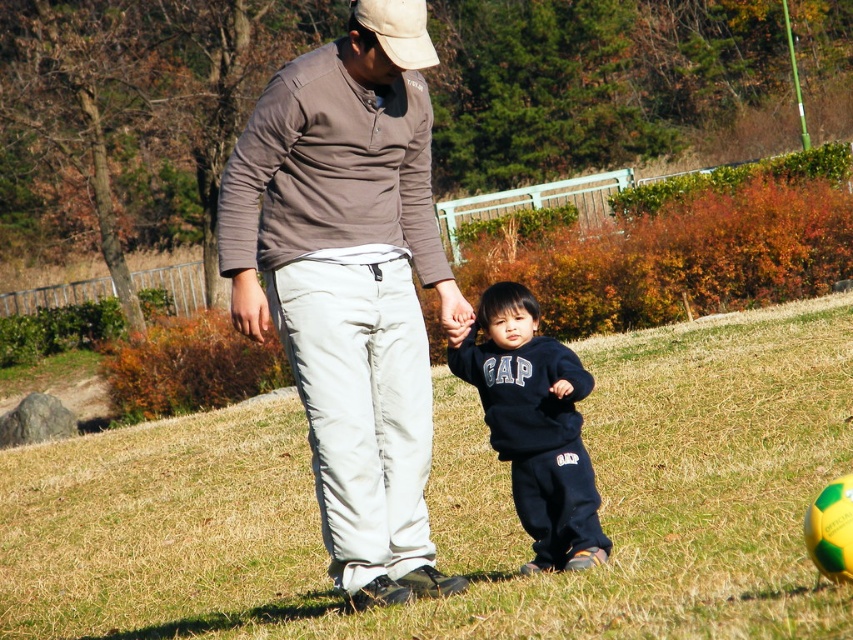
Is black fleece sweatshirt at center bigger than white fabric baseball cap at upper center?

Yes.

Describe the element at coordinates (535, 426) in the screenshot. I see `black fleece sweatshirt at center` at that location.

At what (x,y) coordinates should I click in order to perform the action: click on black fleece sweatshirt at center. Please return your answer as a coordinate pair (x, y). Looking at the image, I should click on (535, 426).

Who is higher up, matte brown shirt at center or black fleece sweatshirt at center?

Positioned higher is matte brown shirt at center.

Can you confirm if matte brown shirt at center is thinner than black fleece sweatshirt at center?

Correct, matte brown shirt at center's width is less than black fleece sweatshirt at center's.

Does point (288, 264) come farther from viewer compared to point (527, 337)?

No, (288, 264) is in front of (527, 337).

Where is `matte brown shirt at center`? This screenshot has height=640, width=853. matte brown shirt at center is located at coordinates (347, 294).

Which is above, green grass at center or white fabric baseball cap at upper center?

white fabric baseball cap at upper center is above.

Looking at this image, who is taller, green grass at center or white fabric baseball cap at upper center?

With more height is green grass at center.

Locate an element on the screen. green grass at center is located at coordinates (463, 506).